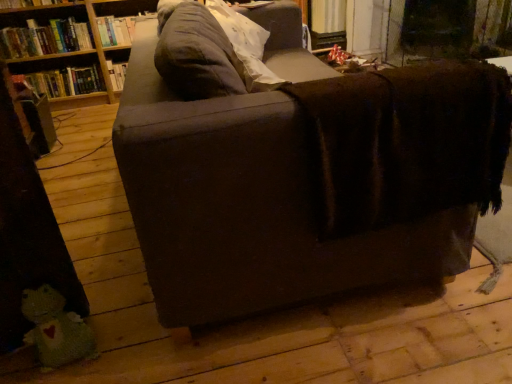
Question: From a real-world perspective, is hardcover book at left, which is the first book from bottom to top, physically above hardcover book at upper left, which ranks as the 2th book in top-to-bottom order?

Choices:
 (A) no
 (B) yes

Answer: (A)

Question: Can you confirm if hardcover book at left, which is the first book from bottom to top, is smaller than hardcover book at upper left, the second book from the bottom?

Choices:
 (A) no
 (B) yes

Answer: (B)

Question: Can hardcover book at upper left, the second book from the bottom, be found inside hardcover book at left, the third book in the top-to-bottom sequence?

Choices:
 (A) yes
 (B) no

Answer: (B)

Question: From the image's perspective, is hardcover book at left, which is the first book from bottom to top, below hardcover book at upper left, which ranks as the 2th book in top-to-bottom order?

Choices:
 (A) no
 (B) yes

Answer: (B)

Question: Can you confirm if hardcover book at left, which is the first book from bottom to top, is wider than hardcover book at upper left, the second book from the bottom?

Choices:
 (A) yes
 (B) no

Answer: (B)

Question: Considering the positions of soft gray pillow at upper center and green knitted toy at lower left in the image, is soft gray pillow at upper center bigger or smaller than green knitted toy at lower left?

Choices:
 (A) small
 (B) big

Answer: (B)

Question: Is soft gray pillow at upper center inside or outside of green knitted toy at lower left?

Choices:
 (A) outside
 (B) inside

Answer: (A)

Question: Is point (225, 29) positioned closer to the camera than point (45, 324)?

Choices:
 (A) closer
 (B) farther

Answer: (B)

Question: In terms of width, does soft gray pillow at upper center look wider or thinner when compared to green knitted toy at lower left?

Choices:
 (A) thin
 (B) wide

Answer: (B)

Question: Considering the relative positions of hardcover book at upper left, which ranks as the 2th book in top-to-bottom order, and soft gray pillow at upper center in the image provided, is hardcover book at upper left, which ranks as the 2th book in top-to-bottom order, to the left or to the right of soft gray pillow at upper center?

Choices:
 (A) right
 (B) left

Answer: (B)

Question: Looking at the image, does hardcover book at upper left, the second book from the bottom, seem bigger or smaller compared to soft gray pillow at upper center?

Choices:
 (A) big
 (B) small

Answer: (B)

Question: From the image's perspective, is hardcover book at upper left, the second book from the bottom, positioned above or below soft gray pillow at upper center?

Choices:
 (A) above
 (B) below

Answer: (A)

Question: Considering the positions of point (48, 36) and point (245, 49), is point (48, 36) closer or farther from the camera than point (245, 49)?

Choices:
 (A) farther
 (B) closer

Answer: (A)

Question: From a real-world perspective, is hardcover book at upper left, which ranks as the 2th book in top-to-bottom order, positioned above or below hardcover book at left, the third book in the top-to-bottom sequence?

Choices:
 (A) below
 (B) above

Answer: (B)

Question: From their relative heights in the image, would you say hardcover book at upper left, the second book from the bottom, is taller or shorter than hardcover book at left, which is the first book from bottom to top?

Choices:
 (A) short
 (B) tall

Answer: (B)